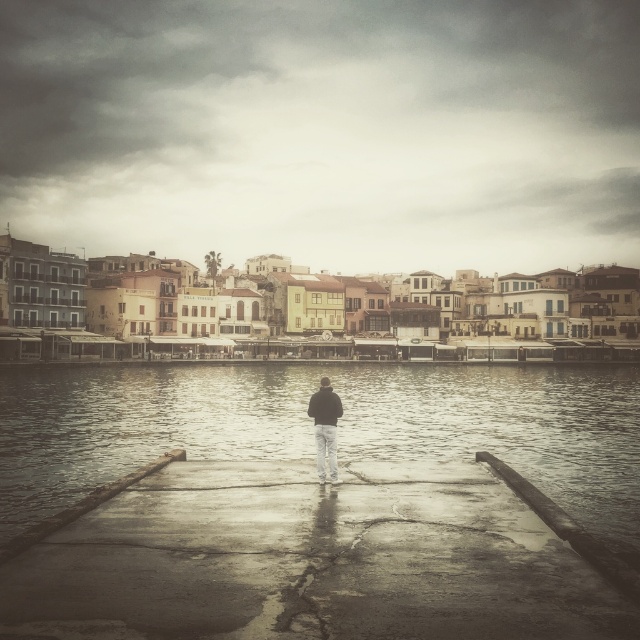
Question: Among these points, which one is nearest to the camera?

Choices:
 (A) (321, 461)
 (B) (134, 536)

Answer: (B)

Question: Among these objects, which one is farthest from the camera?

Choices:
 (A) dark blue jacket at center
 (B) concrete wet dock at center

Answer: (A)

Question: In this image, where is concrete wet dock at center located relative to dark blue jacket at center?

Choices:
 (A) right
 (B) left

Answer: (B)

Question: Can you confirm if concrete wet dock at center is smaller than dark blue jacket at center?

Choices:
 (A) no
 (B) yes

Answer: (A)

Question: Is concrete wet dock at center above dark blue jacket at center?

Choices:
 (A) no
 (B) yes

Answer: (A)